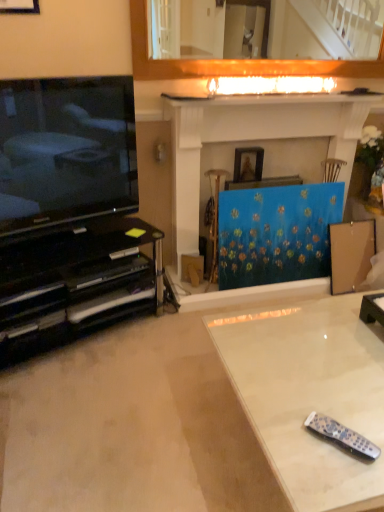
Question: Is wooden picture frame at upper left, positioned as the first picture frame in top-to-bottom order, smaller than blue textured fabric at center?

Choices:
 (A) yes
 (B) no

Answer: (A)

Question: Is wooden picture frame at upper left, the 2th picture frame from the bottom, at the left side of blue textured fabric at center?

Choices:
 (A) yes
 (B) no

Answer: (A)

Question: Does wooden picture frame at upper left, acting as the 2th picture frame starting from the back, have a lesser width compared to blue textured fabric at center?

Choices:
 (A) yes
 (B) no

Answer: (A)

Question: Would you say blue textured fabric at center is part of wooden picture frame at upper left, which is counted as the first picture frame, starting from the front,'s contents?

Choices:
 (A) yes
 (B) no

Answer: (B)

Question: From the image's perspective, would you say wooden picture frame at upper left, which is counted as the first picture frame, starting from the front, is shown under blue textured fabric at center?

Choices:
 (A) yes
 (B) no

Answer: (B)

Question: Based on their sizes in the image, would you say white glossy table at lower right is bigger or smaller than wooden mirror at upper center?

Choices:
 (A) big
 (B) small

Answer: (A)

Question: From the image's perspective, is white glossy table at lower right positioned above or below wooden mirror at upper center?

Choices:
 (A) above
 (B) below

Answer: (B)

Question: In terms of height, does white glossy table at lower right look taller or shorter compared to wooden mirror at upper center?

Choices:
 (A) short
 (B) tall

Answer: (B)

Question: Is point (273, 446) positioned closer to the camera than point (155, 17)?

Choices:
 (A) farther
 (B) closer

Answer: (B)

Question: Does point (110, 256) appear closer or farther from the camera than point (365, 454)?

Choices:
 (A) closer
 (B) farther

Answer: (B)

Question: Considering the positions of black glass tv stand at lower left and black plastic remote at lower right in the image, is black glass tv stand at lower left taller or shorter than black plastic remote at lower right?

Choices:
 (A) tall
 (B) short

Answer: (A)

Question: Is black glass tv stand at lower left bigger or smaller than black plastic remote at lower right?

Choices:
 (A) small
 (B) big

Answer: (B)

Question: Looking at their shapes, would you say black glass tv stand at lower left is wider or thinner than black plastic remote at lower right?

Choices:
 (A) wide
 (B) thin

Answer: (A)

Question: Considering the positions of white glossy mantle at upper center and wooden picture frame at center, arranged as the second picture frame when viewed from the front, in the image, is white glossy mantle at upper center taller or shorter than wooden picture frame at center, arranged as the second picture frame when viewed from the front,?

Choices:
 (A) tall
 (B) short

Answer: (B)

Question: Do you think white glossy mantle at upper center is within wooden picture frame at center, which is the 2th picture frame in left-to-right order, or outside of it?

Choices:
 (A) outside
 (B) inside

Answer: (A)